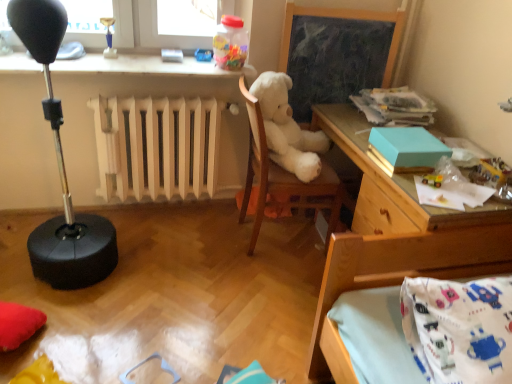
Question: Considering their positions, is translucent plastic container at upper center, the 1th toy when ordered from top to bottom, located in front of or behind white plush at center?

Choices:
 (A) front
 (B) behind

Answer: (B)

Question: Visually, is translucent plastic container at upper center, which is the third toy from right to left, positioned to the left or to the right of white plush at center?

Choices:
 (A) right
 (B) left

Answer: (B)

Question: Which is nearer to the metallic silver toy at upper right, marked as the 3th toy in a top-to-bottom arrangement?

Choices:
 (A) translucent plastic container at upper center, which is the third toy from right to left
 (B) white plush at center
 (C) teal matte box at upper right
 (D) wooden chalkboard at center
 (E) blue plastic toy at upper center, the second toy viewed from the top

Answer: (C)

Question: Which object is the closest to the white wooden radiator at center?

Choices:
 (A) translucent plastic container at upper center, which is the second toy in left-to-right order
 (B) wooden chalkboard at center
 (C) white plush teddy bear at center
 (D) metallic yellow toy car at upper right, the fourth toy when ordered from back to front
 (E) blue plastic toy at upper center, the second toy viewed from the top

Answer: (A)